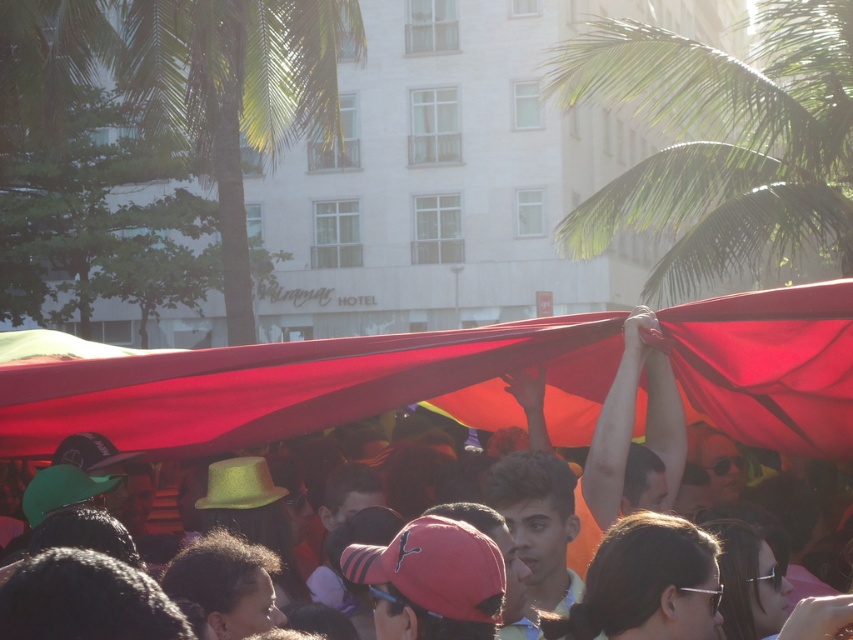
Is point (582, 365) closer to camera compared to point (640, 227)?

Yes, point (582, 365) is in front of point (640, 227).

Is matte red fabric at center shorter than green leafy palm tree at upper right?

Yes, matte red fabric at center is shorter than green leafy palm tree at upper right.

Who is more distant from viewer, (442, 356) or (827, 180)?

The point (827, 180) is more distant.

This screenshot has width=853, height=640. In order to click on matte red fabric at center in this screenshot , I will do `click(310, 387)`.

Can you confirm if matte red fabric at center is positioned above green leafy palm tree at upper center?

Incorrect, matte red fabric at center is not positioned above green leafy palm tree at upper center.

Which is above, matte red fabric at center or green leafy palm tree at upper center?

green leafy palm tree at upper center is above.

Between point (170, 365) and point (306, 113), which one is positioned behind?

Point (306, 113)

At what (x,y) coordinates should I click in order to perform the action: click on matte red fabric at center. Please return your answer as a coordinate pair (x, y). Image resolution: width=853 pixels, height=640 pixels. Looking at the image, I should click on (310, 387).

Is green leafy palm tree at upper right shorter than green leafy palm tree at upper center?

Incorrect, green leafy palm tree at upper right's height does not fall short of green leafy palm tree at upper center's.

Who is higher up, green leafy palm tree at upper right or green leafy palm tree at upper center?

green leafy palm tree at upper right

The image size is (853, 640). In order to click on green leafy palm tree at upper right in this screenshot , I will do `click(722, 141)`.